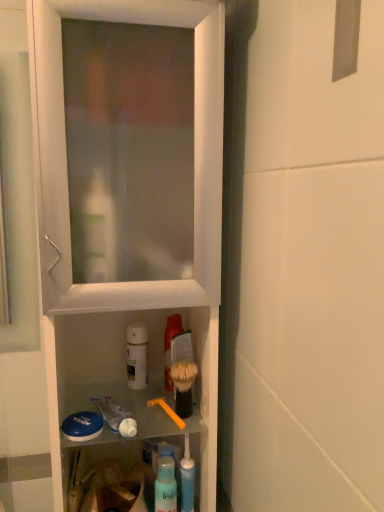
What is the approximate height of orange plastic toothbrush at center?

It is 1.31 inches.

This screenshot has height=512, width=384. Identify the location of white matte bottle at center, which ranks as the second mouthwash in right-to-left order. (137, 356).

Where is `translucent plastic spray bottle at lower center`? The image size is (384, 512). translucent plastic spray bottle at lower center is located at coordinates (165, 485).

This screenshot has width=384, height=512. In order to click on orange plastic toothbrush at center in this screenshot , I will do `click(167, 411)`.

Is white glossy toothpaste at lower center at the back of translucent plastic mouthwash at center, placed as the first mouthwash when sorted from right to left?

No, white glossy toothpaste at lower center is not at the back of translucent plastic mouthwash at center, placed as the first mouthwash when sorted from right to left.

In terms of width, does translucent plastic mouthwash at center, placed as the first mouthwash when sorted from right to left, look wider or thinner when compared to white glossy toothpaste at lower center?

Clearly, translucent plastic mouthwash at center, placed as the first mouthwash when sorted from right to left, has less width compared to white glossy toothpaste at lower center.

Considering the relative positions of translucent plastic mouthwash at center, placed as the first mouthwash when sorted from right to left, and white glossy toothpaste at lower center in the image provided, is translucent plastic mouthwash at center, placed as the first mouthwash when sorted from right to left, to the left of white glossy toothpaste at lower center from the viewer's perspective?

Incorrect, translucent plastic mouthwash at center, placed as the first mouthwash when sorted from right to left, is not on the left side of white glossy toothpaste at lower center.

Is translucent plastic mouthwash at center, placed as the first mouthwash when sorted from right to left, located outside white glossy toothpaste at lower center?

Yes, translucent plastic mouthwash at center, placed as the first mouthwash when sorted from right to left, is located beyond the bounds of white glossy toothpaste at lower center.

From a real-world perspective, is orange plastic toothbrush at center positioned over white matte bottle at center, positioned as the first mouthwash in left-to-right order, based on gravity?

No, from a real-world perspective, orange plastic toothbrush at center is not on top of white matte bottle at center, positioned as the first mouthwash in left-to-right order.

The width and height of the screenshot is (384, 512). Find the location of `the 1st mouthwash positioned above the orange plastic toothbrush at center (from the image's perspective)`. the 1st mouthwash positioned above the orange plastic toothbrush at center (from the image's perspective) is located at coordinates (137, 356).

Considering the positions of points (176, 422) and (132, 362), is point (176, 422) closer to camera compared to point (132, 362)?

Yes, it is.

Which point is more distant from viewer, (169, 475) or (119, 405)?

The point (119, 405) is more distant.

From the image's perspective, is translucent plastic spray bottle at lower center located above white glossy toothpaste at lower center?

Actually, translucent plastic spray bottle at lower center appears below white glossy toothpaste at lower center in the image.

Who is bigger, translucent plastic spray bottle at lower center or white glossy toothpaste at lower center?

translucent plastic spray bottle at lower center is bigger.

Is translucent plastic spray bottle at lower center not within white glossy toothpaste at lower center?

Yes, translucent plastic spray bottle at lower center is not within white glossy toothpaste at lower center.

Is point (131, 367) closer or farther from the camera than point (194, 468)?

Point (131, 367) is farther from the camera than point (194, 468).

Who is more distant, white matte bottle at center, positioned as the first mouthwash in left-to-right order, or blue translucent toothpaste tube at lower center?

white matte bottle at center, positioned as the first mouthwash in left-to-right order, is more distant.

I want to click on the 2nd mouthwash counting from the left side of the blue translucent toothpaste tube at lower center, so click(x=137, y=356).

Looking at their sizes, would you say white matte bottle at center, which ranks as the second mouthwash in right-to-left order, is wider or thinner than blue translucent toothpaste tube at lower center?

white matte bottle at center, which ranks as the second mouthwash in right-to-left order, is wider than blue translucent toothpaste tube at lower center.

From a real-world perspective, is orange plastic toothbrush at center positioned above or below white plastic cabinet at center?

From a real-world perspective, orange plastic toothbrush at center is physically below white plastic cabinet at center.

Does orange plastic toothbrush at center turn towards white plastic cabinet at center?

Yes, orange plastic toothbrush at center faces towards white plastic cabinet at center.

Considering the sizes of orange plastic toothbrush at center and white plastic cabinet at center in the image, is orange plastic toothbrush at center taller or shorter than white plastic cabinet at center?

orange plastic toothbrush at center is shorter than white plastic cabinet at center.

From the image's perspective, does orange plastic toothbrush at center appear lower than white plastic cabinet at center?

Yes, from the image's perspective, orange plastic toothbrush at center is below white plastic cabinet at center.

Between white glossy toothpaste at lower center and orange plastic toothbrush at center, which one is positioned in front?

white glossy toothpaste at lower center is more forward.

Can you confirm if white glossy toothpaste at lower center is thinner than orange plastic toothbrush at center?

Correct, the width of white glossy toothpaste at lower center is less than that of orange plastic toothbrush at center.

Where is `brush that appears below the white glossy toothpaste at lower center (from the image's perspective)`? The image size is (384, 512). brush that appears below the white glossy toothpaste at lower center (from the image's perspective) is located at coordinates (167, 411).

Does white glossy toothpaste at lower center have a smaller size compared to orange plastic toothbrush at center?

Yes, white glossy toothpaste at lower center is smaller than orange plastic toothbrush at center.

Would you consider white matte bottle at center, positioned as the first mouthwash in left-to-right order, to be distant from white plastic cabinet at center?

No.

Between white matte bottle at center, positioned as the first mouthwash in left-to-right order, and white plastic cabinet at center, which one has smaller size?

white matte bottle at center, positioned as the first mouthwash in left-to-right order, is smaller.

From a real-world perspective, which object stands above the other?

white plastic cabinet at center, from a real-world perspective.

Is white matte bottle at center, which ranks as the second mouthwash in right-to-left order, positioned with its back to white plastic cabinet at center?

Yes.

This screenshot has width=384, height=512. There is a white glossy toothpaste at lower center. What are the coordinates of `the 2nd mouthwash above it (from a real-world perspective)` in the screenshot? It's located at (170, 346).

Image resolution: width=384 pixels, height=512 pixels. What are the coordinates of `brush below the white matte bottle at center, positioned as the first mouthwash in left-to-right order (from the image's perspective)` in the screenshot? It's located at (167, 411).

From the picture: Considering their positions, is translucent plastic mouthwash at center, which is counted as the 2th mouthwash, starting from the left, positioned closer to translucent plastic spray bottle at lower center than white glossy toothpaste at lower center?

Among the two, white glossy toothpaste at lower center is located nearer to translucent plastic spray bottle at lower center.

From the image, which object appears to be farther from translucent plastic mouthwash at center, which is counted as the 2th mouthwash, starting from the left, white glossy toothpaste at lower center or translucent plastic spray bottle at lower center?

translucent plastic spray bottle at lower center is positioned further to the anchor translucent plastic mouthwash at center, which is counted as the 2th mouthwash, starting from the left.

From the image, which object appears to be farther from orange plastic toothbrush at center, white plastic cabinet at center or translucent plastic mouthwash at center, which is counted as the 2th mouthwash, starting from the left?

white plastic cabinet at center is positioned further to the anchor orange plastic toothbrush at center.

When comparing their distances from white plastic cabinet at center, does translucent plastic spray bottle at lower center or blue translucent toothpaste tube at lower center seem further?

blue translucent toothpaste tube at lower center is further to white plastic cabinet at center.

From the image, which object appears to be farther from white glossy toothpaste at lower center, white plastic cabinet at center or white matte bottle at center, which ranks as the second mouthwash in right-to-left order?

white plastic cabinet at center is further to white glossy toothpaste at lower center.

Which object lies further to the anchor point white matte bottle at center, which ranks as the second mouthwash in right-to-left order, translucent plastic spray bottle at lower center or blue translucent toothpaste tube at lower center?

Based on the image, blue translucent toothpaste tube at lower center appears to be further to white matte bottle at center, which ranks as the second mouthwash in right-to-left order.

Looking at the image, which one is located further to white glossy toothpaste at lower center, blue translucent toothpaste tube at lower center or white matte bottle at center, which ranks as the second mouthwash in right-to-left order?

blue translucent toothpaste tube at lower center.

Estimate the real-world distances between objects in this image. Which object is closer to orange plastic toothbrush at center, translucent plastic spray bottle at lower center or translucent plastic mouthwash at center, which is counted as the 2th mouthwash, starting from the left?

Based on the image, translucent plastic mouthwash at center, which is counted as the 2th mouthwash, starting from the left, appears to be nearer to orange plastic toothbrush at center.

Find the location of a particular element. brush between translucent plastic mouthwash at center, which is counted as the 2th mouthwash, starting from the left, and blue translucent toothpaste tube at lower center vertically is located at coordinates (167, 411).

This screenshot has width=384, height=512. Identify the location of brush between white plastic cabinet at center and white matte bottle at center, which ranks as the second mouthwash in right-to-left order, in the front-back direction. pyautogui.click(x=167, y=411).

Where is `mouthwash located between orange plastic toothbrush at center and white matte bottle at center, positioned as the first mouthwash in left-to-right order, in the depth direction`? The image size is (384, 512). mouthwash located between orange plastic toothbrush at center and white matte bottle at center, positioned as the first mouthwash in left-to-right order, in the depth direction is located at coordinates (170, 346).

Locate an element on the screen. Image resolution: width=384 pixels, height=512 pixels. brush between translucent plastic mouthwash at center, which is counted as the 2th mouthwash, starting from the left, and translucent plastic spray bottle at lower center, in the vertical direction is located at coordinates (167, 411).